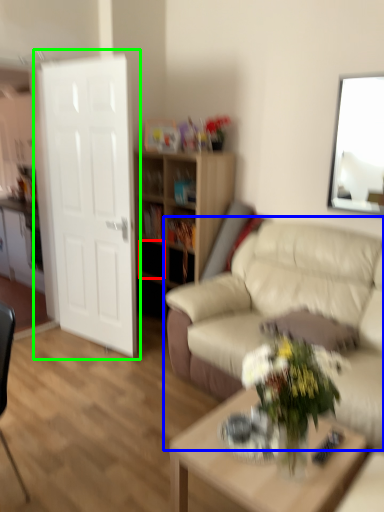
Question: Based on their relative distances, which object is nearer to drawer (highlighted by a red box)? Choose from studio couch (highlighted by a blue box) and door (highlighted by a green box).

Choices:
 (A) studio couch
 (B) door

Answer: (B)